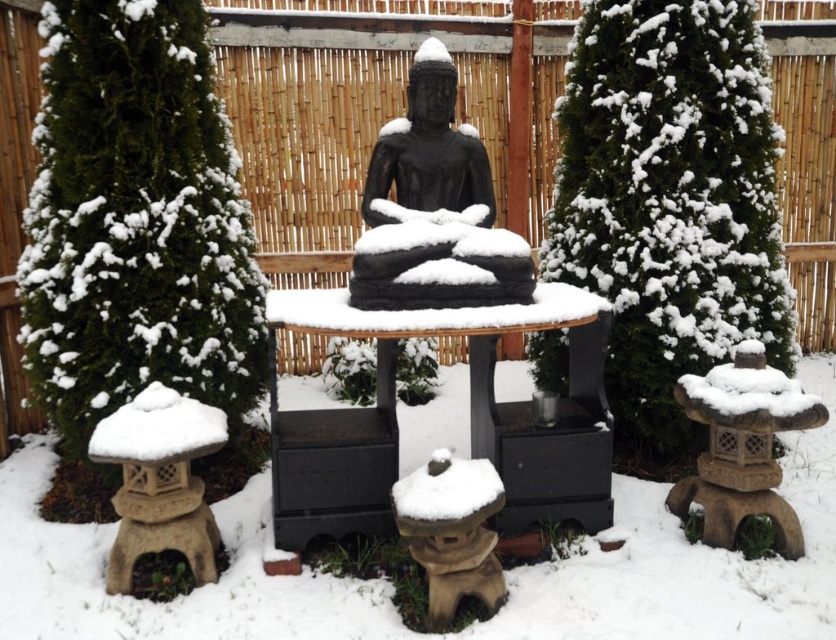
You are a visitor at this winter garden and want to place a small snow globe on the largest object in the scene. Which object should you choose between the black matte table at center and the black stone statue at center?

The black matte table at center is larger than the black stone statue at center, so you should place the snow globe on the black matte table at center.

You are a delivery person who needs to place a small package on the black matte table at center. The package requires a stable surface that is at least 20 inches away from the black stone statue at center to avoid blocking its view. Can you place the package there?

The black matte table at center is only 19.27 inches away from the black stone statue at center, which is less than the required 20 inches. Therefore, placing the package there would not meet the distance requirement and might block the view of the statue.

You are a visitor standing in front of the black matte table at center and the black stone statue at center. Which object is taller?

The black stone statue at center is taller than the black matte table at center.